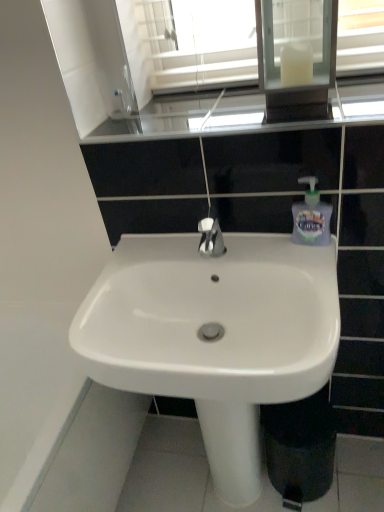
Question: Is white glass medicine cabinet at upper center shorter than glossy glass window sill at upper center?

Choices:
 (A) yes
 (B) no

Answer: (B)

Question: From the image's perspective, is white glass medicine cabinet at upper center under glossy glass window sill at upper center?

Choices:
 (A) yes
 (B) no

Answer: (B)

Question: Is white glass medicine cabinet at upper center outside of glossy glass window sill at upper center?

Choices:
 (A) yes
 (B) no

Answer: (A)

Question: Is white glass medicine cabinet at upper center to the right of glossy glass window sill at upper center from the viewer's perspective?

Choices:
 (A) yes
 (B) no

Answer: (A)

Question: Is glossy glass window sill at upper center surrounded by white glass medicine cabinet at upper center?

Choices:
 (A) yes
 (B) no

Answer: (B)

Question: Is translucent plastic soap dispenser at right bigger or smaller than white glossy sink at center?

Choices:
 (A) big
 (B) small

Answer: (B)

Question: Relative to white glossy sink at center, is translucent plastic soap dispenser at right in front or behind?

Choices:
 (A) behind
 (B) front

Answer: (A)

Question: Is point (306, 202) closer or farther from the camera than point (147, 305)?

Choices:
 (A) closer
 (B) farther

Answer: (A)

Question: Is translucent plastic soap dispenser at right spatially inside white glossy sink at center, or outside of it?

Choices:
 (A) outside
 (B) inside

Answer: (A)

Question: Is translucent plastic soap dispenser at right wider or thinner than glossy glass window sill at upper center?

Choices:
 (A) thin
 (B) wide

Answer: (A)

Question: Considering the positions of point (327, 236) and point (253, 98), is point (327, 236) closer or farther from the camera than point (253, 98)?

Choices:
 (A) closer
 (B) farther

Answer: (A)

Question: From the image's perspective, is translucent plastic soap dispenser at right above or below glossy glass window sill at upper center?

Choices:
 (A) below
 (B) above

Answer: (A)

Question: From a real-world perspective, relative to glossy glass window sill at upper center, is translucent plastic soap dispenser at right vertically above or below?

Choices:
 (A) below
 (B) above

Answer: (A)

Question: Looking at their shapes, would you say glossy glass window sill at upper center is wider or thinner than white glass medicine cabinet at upper center?

Choices:
 (A) thin
 (B) wide

Answer: (B)

Question: In the image, is glossy glass window sill at upper center on the left side or the right side of white glass medicine cabinet at upper center?

Choices:
 (A) right
 (B) left

Answer: (B)